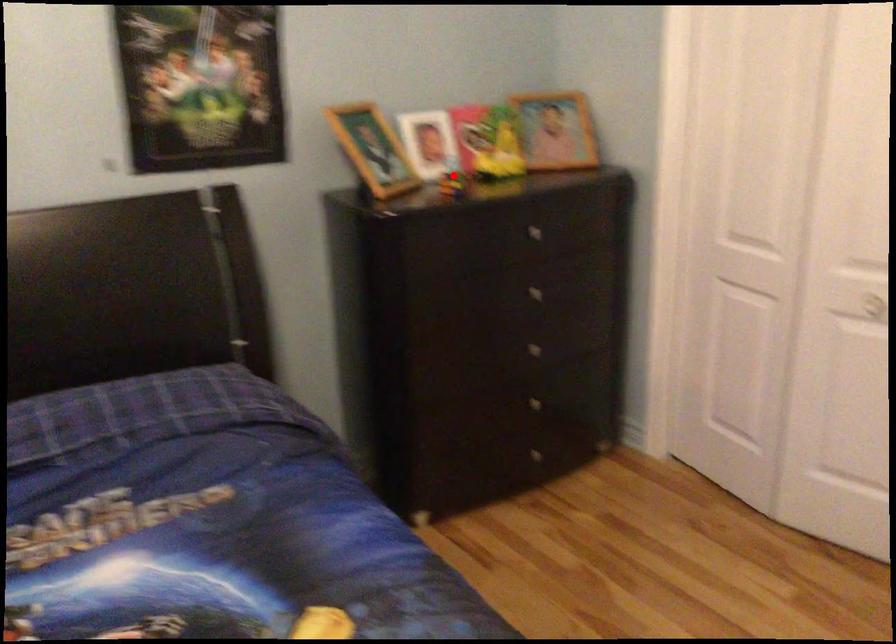
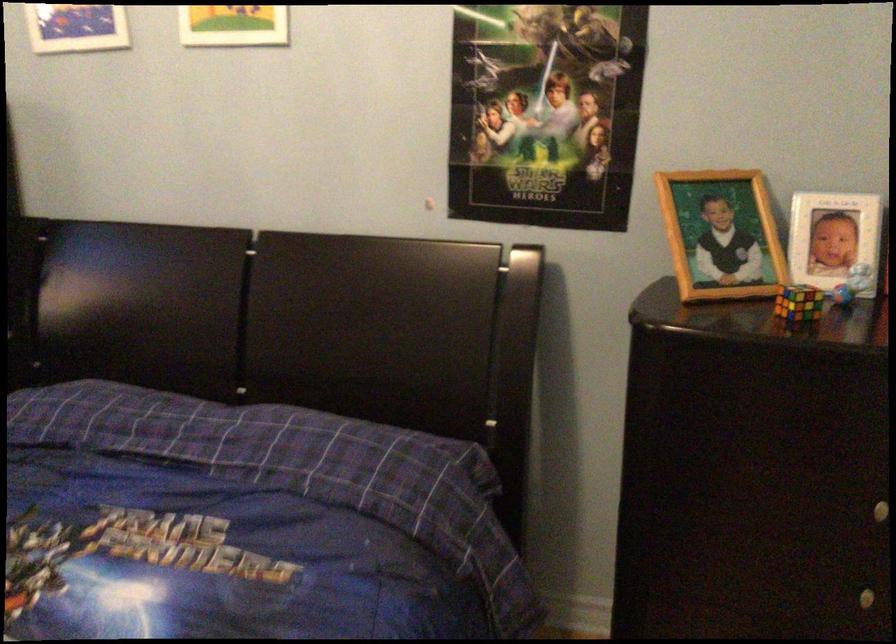
Find the pixel in the second image that matches the highlighted location in the first image.

(798, 303)